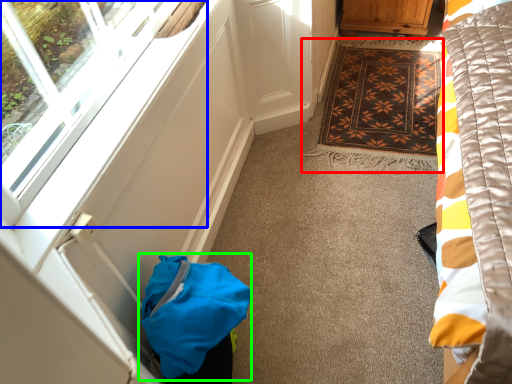
Question: Considering the real-world distances, which object is farthest from mat (highlighted by a red box)? window (highlighted by a blue box) or bag (highlighted by a green box)?

Choices:
 (A) window
 (B) bag

Answer: (B)